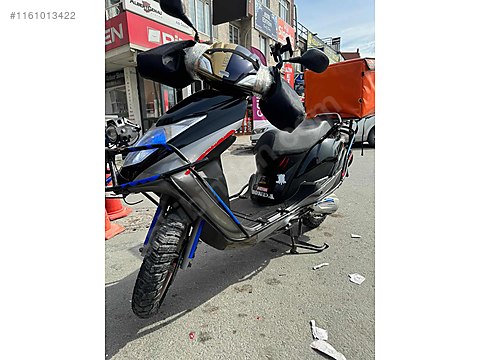
Where is `trash`? trash is located at coordinates (358, 282), (321, 330), (325, 349), (319, 265), (353, 236).